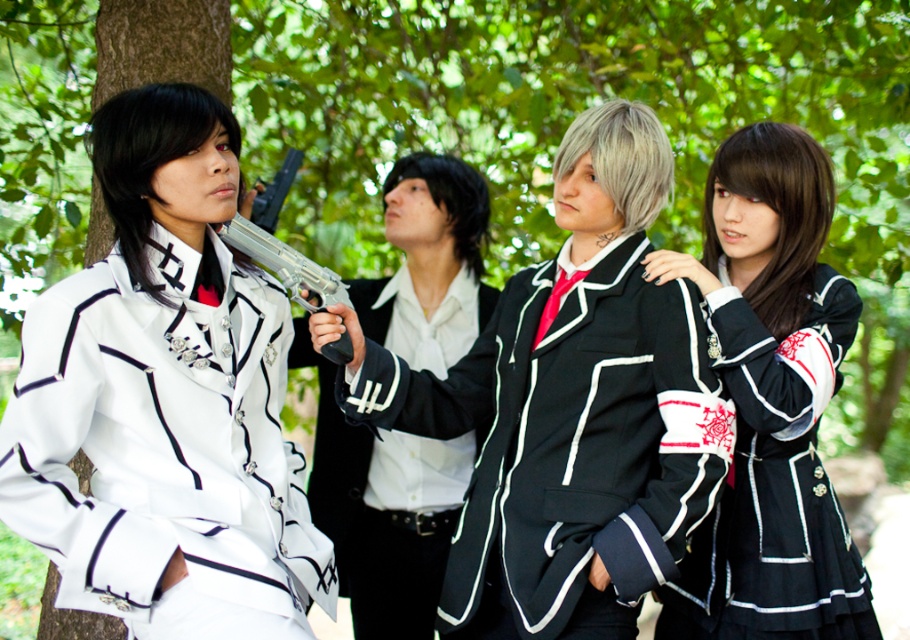
Question: Estimate the real-world distances between objects in this image. Which object is farther from the silver metallic revolver at center?

Choices:
 (A) white glossy uniform at left
 (B) black satin blazer at center

Answer: (B)

Question: Can you confirm if white glossy uniform at left is thinner than white glossy shirt at center?

Choices:
 (A) yes
 (B) no

Answer: (B)

Question: Does black satin blazer at center come behind white glossy shirt at center?

Choices:
 (A) no
 (B) yes

Answer: (A)

Question: Is black satin blazer at center thinner than black satin dress at right?

Choices:
 (A) yes
 (B) no

Answer: (B)

Question: Which object is farther from the camera taking this photo?

Choices:
 (A) black satin blazer at center
 (B) black satin dress at right
 (C) silver metallic revolver at center

Answer: (B)

Question: Which object is closer to the camera taking this photo?

Choices:
 (A) white glossy uniform at left
 (B) black satin dress at right
 (C) black satin blazer at center
 (D) white glossy shirt at center

Answer: (A)